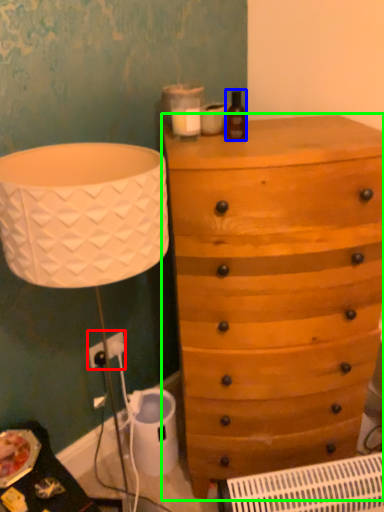
Question: Which is farther away from electric outlet (highlighted by a red box)? bottle (highlighted by a blue box) or chest of drawers (highlighted by a green box)?

Choices:
 (A) bottle
 (B) chest of drawers

Answer: (A)